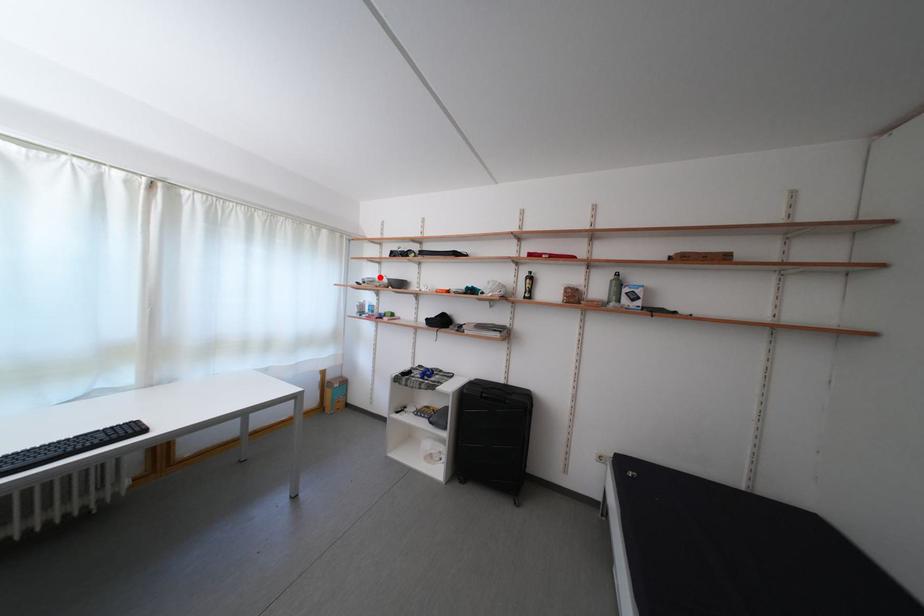
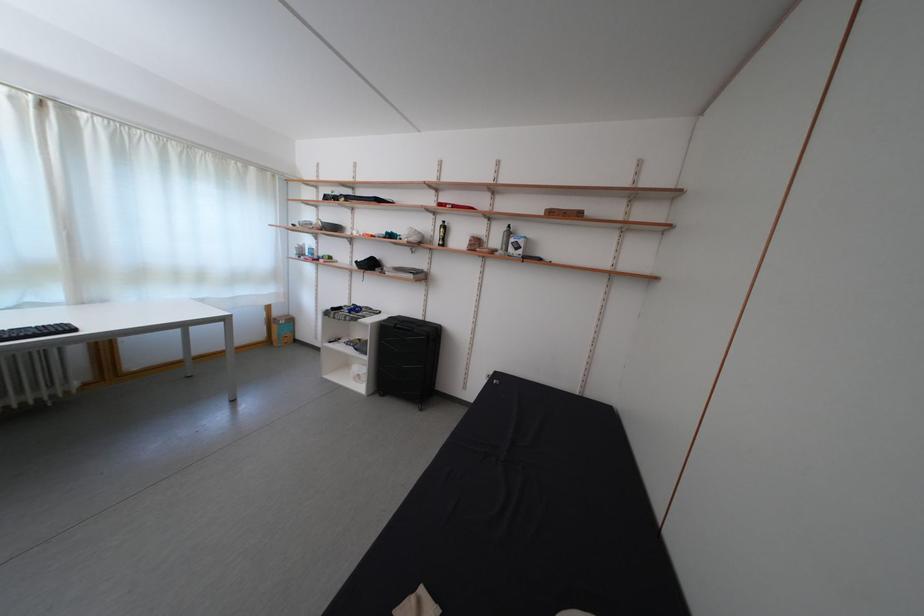
In the second image, find the point that corresponds to the highlighted location in the first image.

(319, 221)